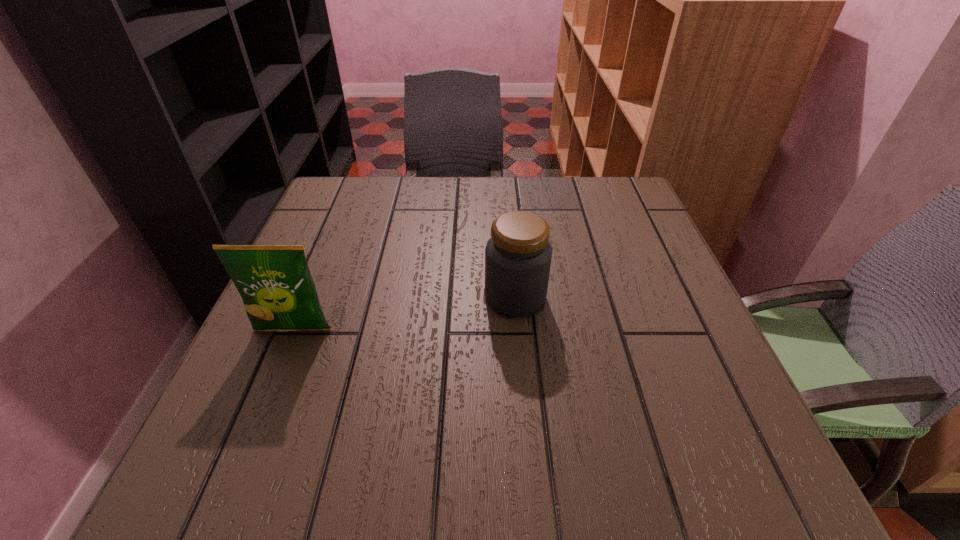
Locate an element on the screen. The height and width of the screenshot is (540, 960). crisp (potato chip) is located at coordinates (276, 286).

This screenshot has width=960, height=540. What are the coordinates of `the right object` in the screenshot? It's located at (518, 255).

Find the location of `free location located on the front-facing side of the crisp (potato chip)`. free location located on the front-facing side of the crisp (potato chip) is located at coordinates click(x=267, y=393).

The image size is (960, 540). I want to click on vacant space located on the surface of the jar near the warning symbol, so click(400, 297).

I want to click on vacant space located 0.240m on the surface of the jar near the warning symbol, so click(366, 297).

What are the coordinates of `vacant area situated on the surface of the jar near the warning symbol` in the screenshot? It's located at (336, 297).

The height and width of the screenshot is (540, 960). Identify the location of object positioned at the left edge. (276, 286).

What are the coordinates of `vacant region at the far edge of the desktop` in the screenshot? It's located at (431, 213).

The height and width of the screenshot is (540, 960). I want to click on free space at the left edge of the desktop, so click(x=348, y=252).

The height and width of the screenshot is (540, 960). I want to click on vacant area at the right edge, so click(666, 262).